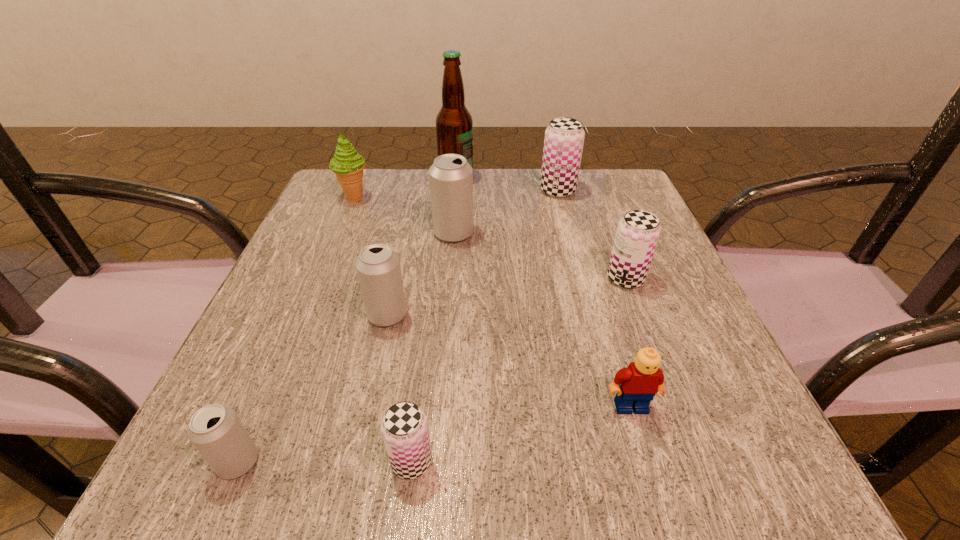
I want to click on beer can that is at the left edge, so click(x=215, y=430).

At what (x,y) coordinates should I click in order to perform the action: click on Lego positioned at the right edge. Please return your answer as a coordinate pair (x, y). Looking at the image, I should click on (636, 385).

You are a GUI agent. You are given a task and a screenshot of the screen. Output one action in this format:
    pyautogui.click(x=<x>, y=<y>)
    Task: Click on the object present at the far left corner
    The image size is (960, 540).
    Given the screenshot: What is the action you would take?
    pyautogui.click(x=347, y=164)

Locate an element on the screen. object that is at the near left corner is located at coordinates (215, 430).

Locate an element on the screen. object present at the far right corner is located at coordinates (563, 144).

You are a GUI agent. You are given a task and a screenshot of the screen. Output one action in this format:
    pyautogui.click(x=<x>, y=<y>)
    Task: Click on the vacant area at the near edge
    The image size is (960, 540).
    Given the screenshot: What is the action you would take?
    pyautogui.click(x=329, y=430)

Identify the location of vacant space at the left edge of the desktop. (323, 271).

In the image, there is a desktop. Identify the location of vacant area at the right edge. Image resolution: width=960 pixels, height=540 pixels. (696, 327).

Where is `vacant space at the far left corner`? The height and width of the screenshot is (540, 960). vacant space at the far left corner is located at coordinates (364, 215).

I want to click on free space at the far right corner, so point(632,180).